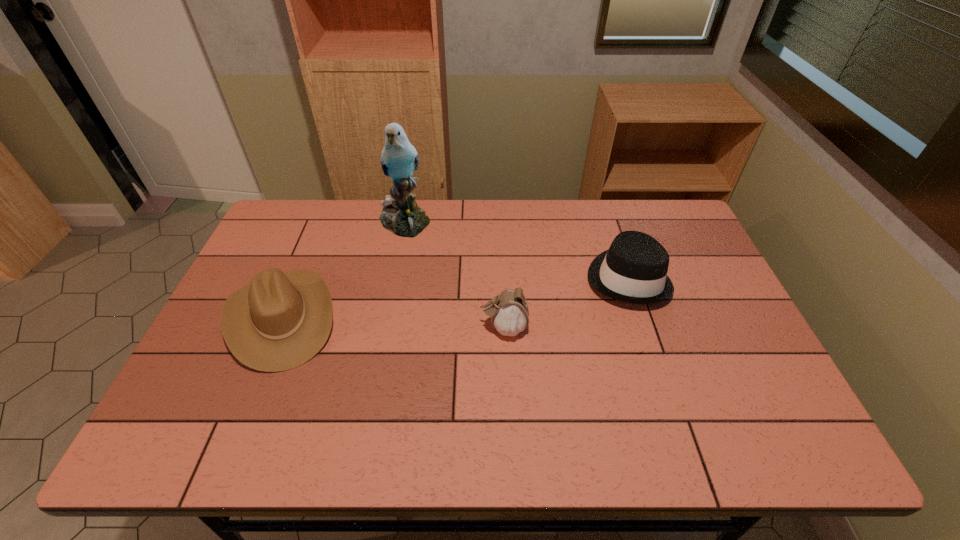
This screenshot has height=540, width=960. I want to click on free space between the rightmost object and the parakeet, so click(516, 249).

The width and height of the screenshot is (960, 540). Identify the location of empty space that is in between the third object from left to right and the parakeet. (454, 274).

The image size is (960, 540). Identify the location of empty space that is in between the rightmost object and the third object from left to right. (565, 303).

At what (x,y) coordinates should I click in order to perform the action: click on vacant space that's between the rightmost object and the leftmost object. Please return your answer as a coordinate pair (x, y). This screenshot has height=540, width=960. Looking at the image, I should click on (454, 298).

At what (x,y) coordinates should I click in order to perform the action: click on free area in between the leftmost object and the second object from right to left. Please return your answer as a coordinate pair (x, y). Looking at the image, I should click on (393, 323).

Where is `vacant area that lies between the cowboy hat and the fedora`? The height and width of the screenshot is (540, 960). vacant area that lies between the cowboy hat and the fedora is located at coordinates (454, 298).

Where is `vacant area that lies between the pouch and the parakeet`? This screenshot has height=540, width=960. vacant area that lies between the pouch and the parakeet is located at coordinates point(454,274).

At what (x,y) coordinates should I click in order to perform the action: click on free spot between the fedora and the pouch. Please return your answer as a coordinate pair (x, y). The image size is (960, 540). Looking at the image, I should click on (565, 303).

This screenshot has width=960, height=540. I want to click on vacant point located between the tallest object and the pouch, so click(x=454, y=274).

Identify which object is the second closest to the rightmost object. Please provide its 2D coordinates. Your answer should be formatted as a tuple, i.e. [(x, y)], where the tuple contains the x and y coordinates of a point satisfying the conditions above.

[(401, 215)]